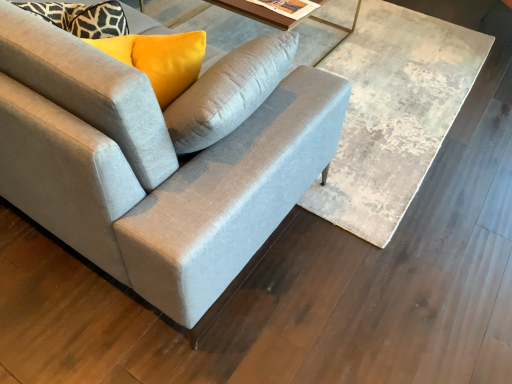
Question: Is matte glass table at upper center smaller than suede gray couch at center?

Choices:
 (A) no
 (B) yes

Answer: (B)

Question: Considering the relative sizes of matte glass table at upper center and suede gray couch at center in the image provided, is matte glass table at upper center taller than suede gray couch at center?

Choices:
 (A) no
 (B) yes

Answer: (A)

Question: Can you see matte glass table at upper center touching suede gray couch at center?

Choices:
 (A) no
 (B) yes

Answer: (A)

Question: Considering the relative positions of matte glass table at upper center and suede gray couch at center in the image provided, is matte glass table at upper center to the left of suede gray couch at center from the viewer's perspective?

Choices:
 (A) yes
 (B) no

Answer: (B)

Question: Can you confirm if matte glass table at upper center is wider than suede gray couch at center?

Choices:
 (A) no
 (B) yes

Answer: (A)

Question: From a real-world perspective, is matte glass table at upper center physically above suede gray couch at center?

Choices:
 (A) yes
 (B) no

Answer: (B)

Question: Is matte glass table at upper center looking in the opposite direction of wooden textured table at center?

Choices:
 (A) yes
 (B) no

Answer: (B)

Question: Can you confirm if matte glass table at upper center is smaller than wooden textured table at center?

Choices:
 (A) yes
 (B) no

Answer: (B)

Question: Is matte glass table at upper center positioned in front of wooden textured table at center?

Choices:
 (A) yes
 (B) no

Answer: (B)

Question: Is matte glass table at upper center bigger than wooden textured table at center?

Choices:
 (A) yes
 (B) no

Answer: (A)

Question: Does matte glass table at upper center lie behind wooden textured table at center?

Choices:
 (A) yes
 (B) no

Answer: (A)

Question: Is matte glass table at upper center shorter than wooden textured table at center?

Choices:
 (A) no
 (B) yes

Answer: (A)

Question: From a real-world perspective, is wooden textured table at center physically above suede gray couch at center?

Choices:
 (A) yes
 (B) no

Answer: (B)